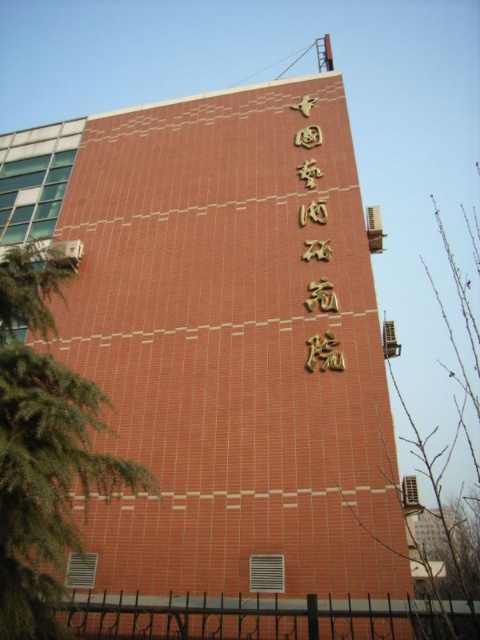
Question: Does green leafy tree at left come behind gold metallic sign at upper center?

Choices:
 (A) yes
 (B) no

Answer: (B)

Question: Is green leafy tree at left closer to camera compared to gold metallic sign at upper center?

Choices:
 (A) yes
 (B) no

Answer: (A)

Question: Which point appears farthest from the camera in this image?

Choices:
 (A) (433, 518)
 (B) (308, 205)
 (C) (31, 385)

Answer: (A)

Question: Which point is closer to the camera?

Choices:
 (A) green leafy tree at center
 (B) gold metallic sign at upper center
 (C) green leafy tree at left

Answer: (C)

Question: Is green leafy tree at left bigger than green leafy tree at center?

Choices:
 (A) no
 (B) yes

Answer: (A)

Question: Which point is farther to the camera?

Choices:
 (A) green leafy tree at center
 (B) green leafy tree at left
 (C) gold metallic sign at upper center

Answer: (C)